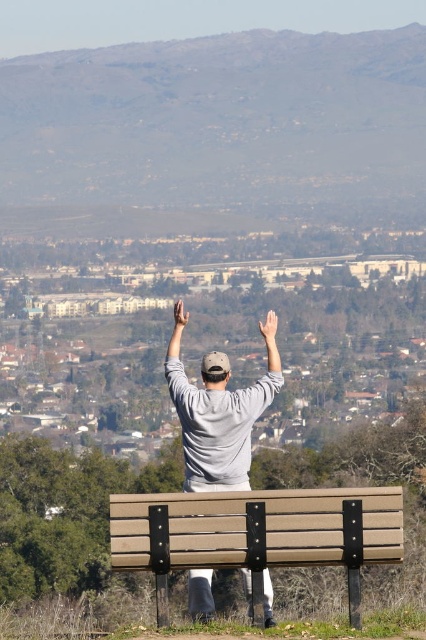
Looking at this image, you are standing at the location of the beige wood bench at center and want to reach the person who is 17.40 meters away. If you walk at a speed of 1.5 meters per second, how many seconds will it take you to reach them?

The distance between the beige wood bench at center and the person is 17.40 meters. At a walking speed of 1.5 meters per second, it will take 17.40 divided by 1.5, which equals approximately 11.6 seconds to reach them.

In the scene shown: You are a photographer trying to capture the scene of the person celebrating. You need to ensure that both the gray matte arm at upper center and the light skin tone hand at upper center are clearly visible in your photo. Considering their sizes, which object should you focus on to ensure both are in frame?

The gray matte arm at upper center is larger in size than the light skin tone hand at upper center, so focusing on the gray matte arm at upper center will help ensure both are in frame as it takes up more space.

You are a fitness trainer designing an exercise routine that requires participants to maintain a specific distance between their arms and hands. You observe the gray matte arm at upper center and the light skin tone hand at upper center in the image. Can the participants replicate the distance shown between these two body parts in the exercise?

The distance between the gray matte arm at upper center and the light skin tone hand at upper center is 1.06 meters. Participants can replicate this distance in their exercise routine by ensuring their arms and hands are positioned 1.06 meters apart.